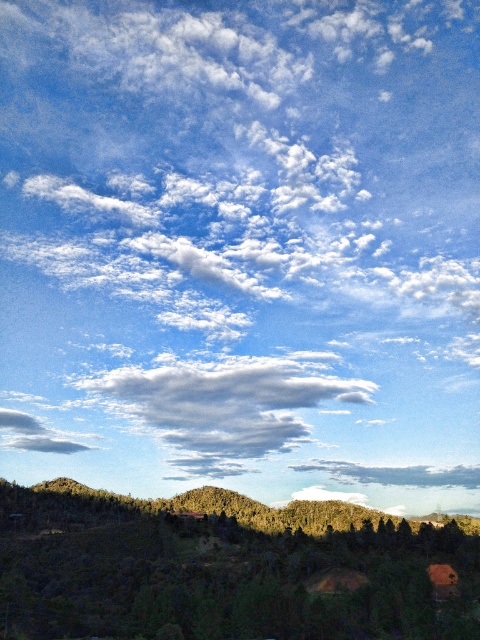
Question: Among these objects, which one is nearest to the camera?

Choices:
 (A) cloudy sky at center
 (B) green textured hillside at lower left

Answer: (B)

Question: Is green textured hillside at lower left positioned behind cloudy sky at center?

Choices:
 (A) no
 (B) yes

Answer: (A)

Question: Is green textured hillside at lower left thinner than cloudy sky at center?

Choices:
 (A) no
 (B) yes

Answer: (A)

Question: Is green textured hillside at lower left in front of cloudy sky at center?

Choices:
 (A) no
 (B) yes

Answer: (B)